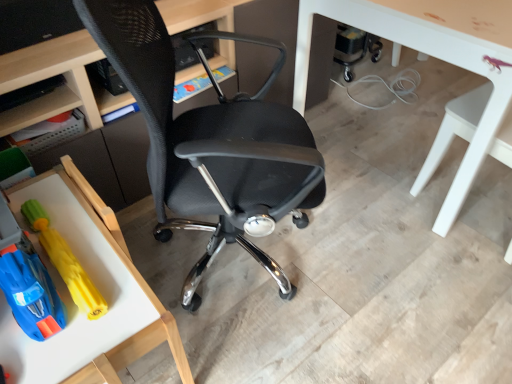
You are a GUI agent. You are given a task and a screenshot of the screen. Output one action in this format:
    pyautogui.click(x=<x>, y=<y>)
    Task: Click on the free point below white glossy table at lower right, which is the first table in right-to-left order (from a real-world perspective)
    
    Given the screenshot: What is the action you would take?
    pyautogui.click(x=400, y=122)